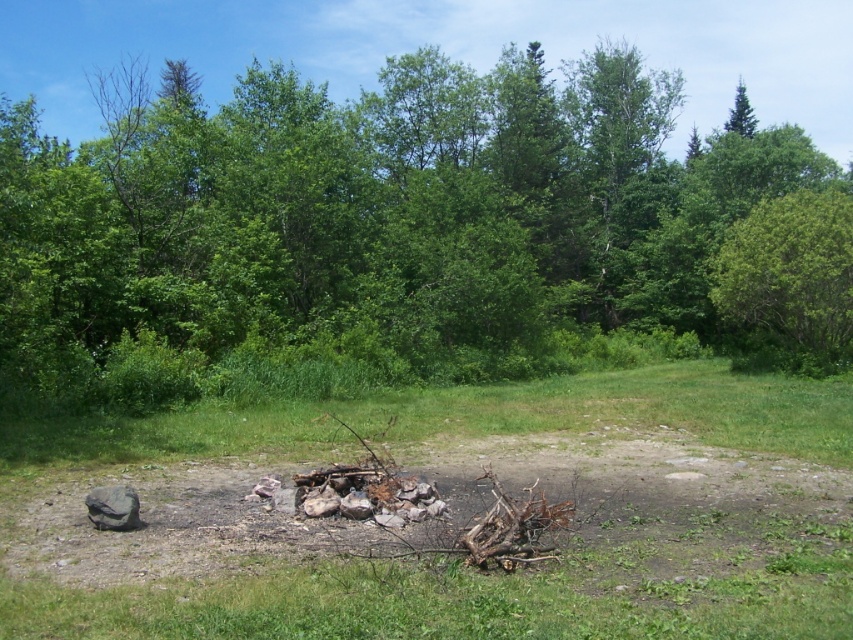
Can you confirm if green leafy tree at center is positioned to the left of green leafy tree at upper right?

Yes, green leafy tree at center is to the left of green leafy tree at upper right.

What do you see at coordinates (374, 220) in the screenshot?
I see `green leafy tree at center` at bounding box center [374, 220].

Measure the distance between green leafy tree at center and camera.

green leafy tree at center is 46.92 feet away from camera.

Find the location of a particular element. This screenshot has height=640, width=853. green leafy tree at center is located at coordinates (374, 220).